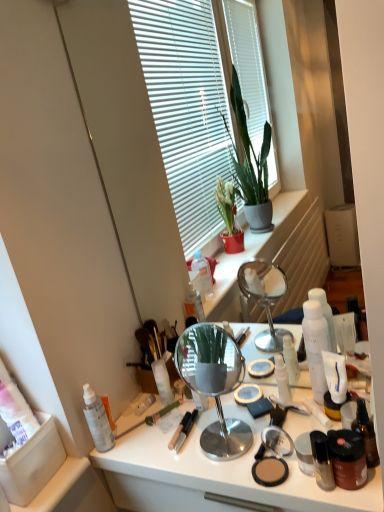
You are a GUI agent. You are given a task and a screenshot of the screen. Output one action in this format:
    pyautogui.click(x=<x>, y=<y>)
    Task: Click on the vacant space that is to the left of shiny brown bottle at right, which is the first toiletry from right to left
    Image resolution: width=384 pixels, height=512 pixels.
    Given the screenshot: What is the action you would take?
    tap(274, 470)